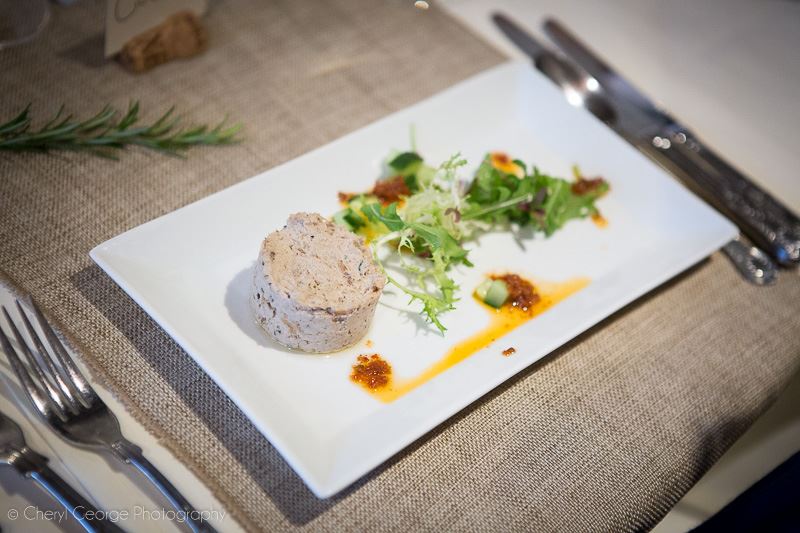
This screenshot has height=533, width=800. What are the coordinates of `white fabric napkin` in the screenshot? It's located at (116, 492).